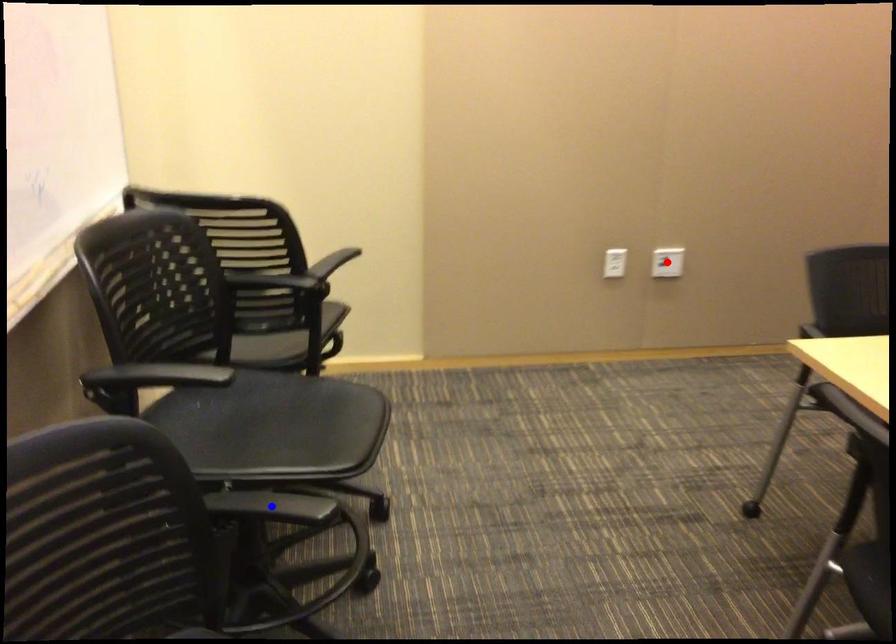
Question: In the image, two points are highlighted. Which point is nearer to the camera? Reply with the corresponding letter.

Choices:
 (A) blue point
 (B) red point

Answer: (A)